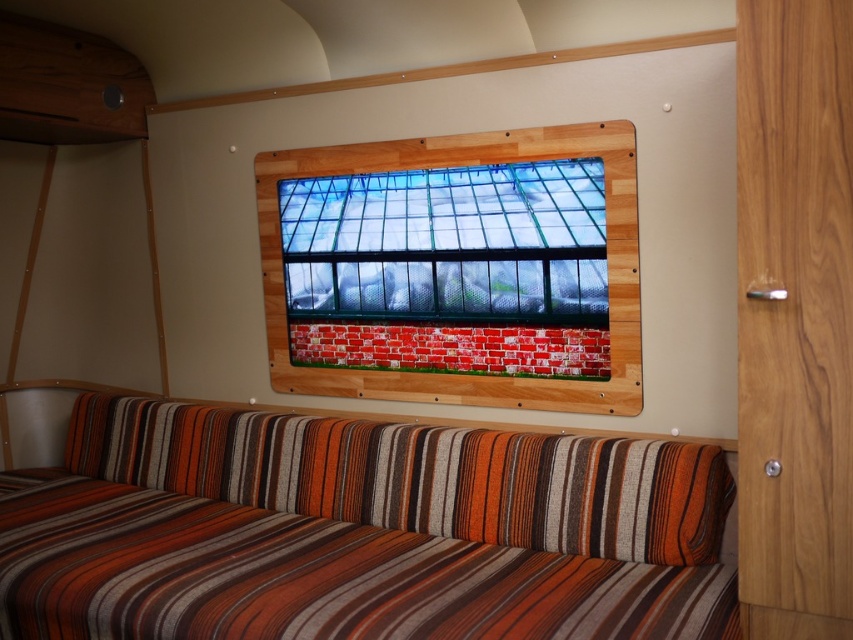
Question: Can you confirm if wooden frame at center is positioned above transparent glass window at upper center?

Choices:
 (A) no
 (B) yes

Answer: (A)

Question: Can you confirm if striped fabric couch at lower center is positioned to the right of wooden frame at center?

Choices:
 (A) yes
 (B) no

Answer: (B)

Question: Considering the relative positions of striped fabric couch at lower center and transparent glass window at upper center in the image provided, where is striped fabric couch at lower center located with respect to transparent glass window at upper center?

Choices:
 (A) below
 (B) above

Answer: (A)

Question: Which of the following is the closest to the observer?

Choices:
 (A) wooden frame at center
 (B) striped fabric couch at lower center

Answer: (B)

Question: Which of the following is the farthest from the observer?

Choices:
 (A) striped fabric couch at lower center
 (B) wooden frame at center
 (C) transparent glass window at upper center

Answer: (C)

Question: Among these objects, which one is farthest from the camera?

Choices:
 (A) transparent glass window at upper center
 (B) striped fabric couch at lower center

Answer: (A)